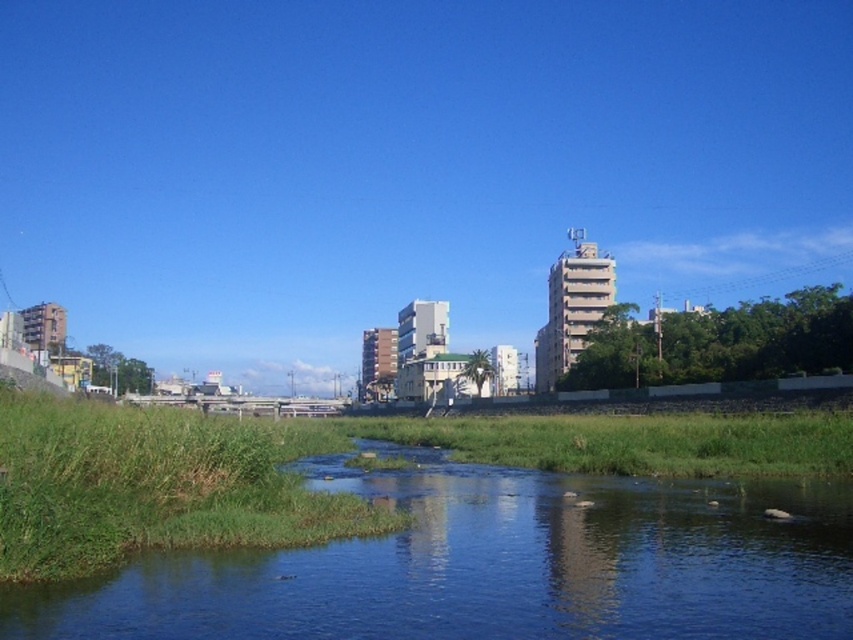
You are standing on the bank of the clear water at center and want to throw a stone to hit a target that is 15 meters away from you. Will the stone reach the target?

The clear water at center has a distance of 13.56 meters between them, so the stone will not reach the target as it is farther than the maximum distance of 13.56 meters.

You are standing at the origin point of the coordinate system in this scene. A boat is anchored at the clear water at center. What are the coordinates of the boat?

The coordinates of the boat at clear water at center are at point (495, 564).